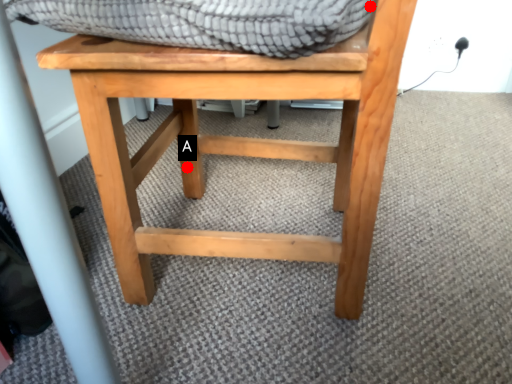
Question: Two points are circled on the image, labeled by A and B beside each circle. Which point is further to the camera?

Choices:
 (A) A is further
 (B) B is further

Answer: (A)